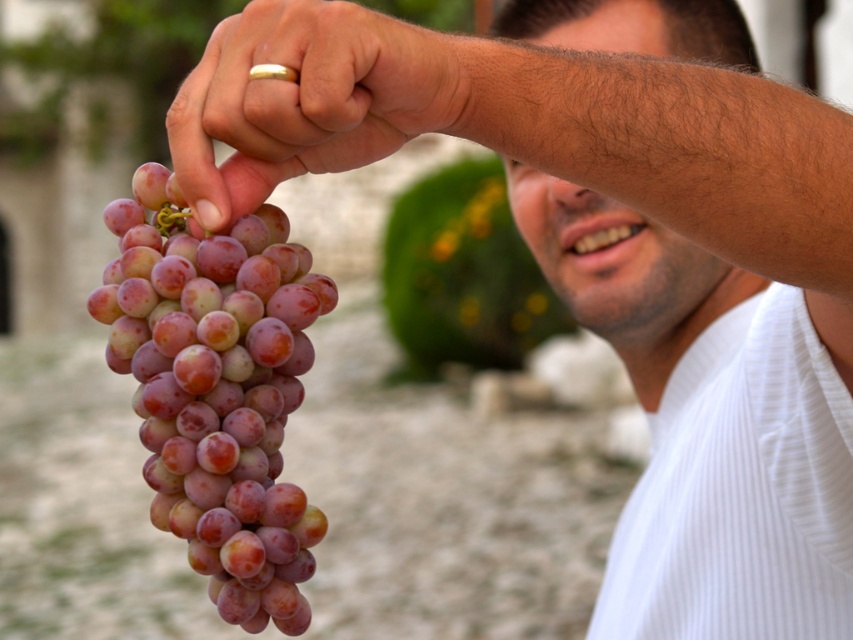
You are a photographer adjusting the lighting for a closeup shot of the purple glossy grapes at left and the matte gold ring at upper center. To ensure both objects are well lit, where should you position the light source relative to the objects?

The purple glossy grapes at left are located below the matte gold ring at upper center. To ensure both are well lit, position the light source above and slightly to the left of the matte gold ring at upper center so it illuminates both objects evenly without casting harsh shadows.

You are a photographer trying to focus on the matte gold ring at upper center while capturing the purple glossy grapes at left. Which object should you adjust your camera focus on first to ensure both are in focus?

The purple glossy grapes at left should be focused on first since they are closer to the viewer than the matte gold ring at upper center. Adjusting focus starting from the closer object ensures depth of field can cover both.

You are a photographer standing 40 inches away from the purple glossy grapes at left. Can you reach them without moving closer?

The purple glossy grapes at left and viewer are 39.18 inches apart, so you are only 0.82 inches away from the grapes. You can easily reach them without moving closer.